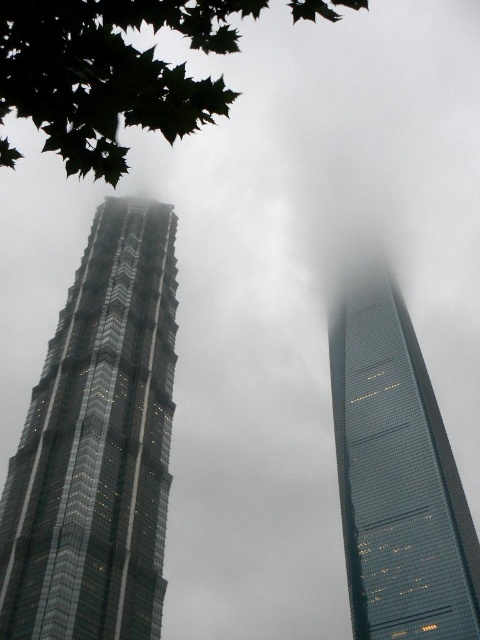
Question: Can you confirm if glassy teal skyscraper at center is smaller than green leafy tree at upper left?

Choices:
 (A) no
 (B) yes

Answer: (B)

Question: Does glassy metallic skyscraper at left appear on the left side of green leafy tree at upper left?

Choices:
 (A) no
 (B) yes

Answer: (A)

Question: Does glassy teal skyscraper at center lie in front of green leafy tree at upper left?

Choices:
 (A) no
 (B) yes

Answer: (A)

Question: Which point is farther to the camera?

Choices:
 (A) glassy metallic skyscraper at left
 (B) glassy teal skyscraper at center

Answer: (B)

Question: Based on their relative distances, which object is farther from the glassy metallic skyscraper at left?

Choices:
 (A) green leafy tree at upper left
 (B) glassy teal skyscraper at center

Answer: (B)

Question: Based on their relative distances, which object is nearer to the glassy metallic skyscraper at left?

Choices:
 (A) green leafy tree at upper left
 (B) glassy teal skyscraper at center

Answer: (A)